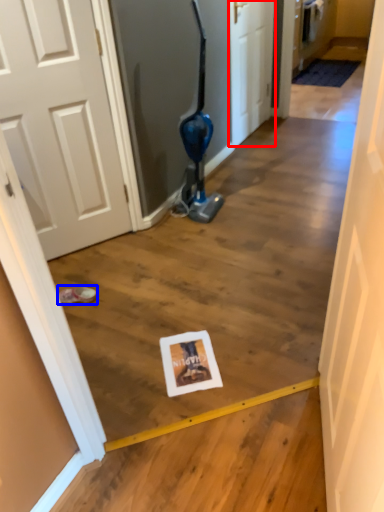
Question: Which of the following is the closest to the observer, door (highlighted by a red box) or footwear (highlighted by a blue box)?

Choices:
 (A) door
 (B) footwear

Answer: (B)